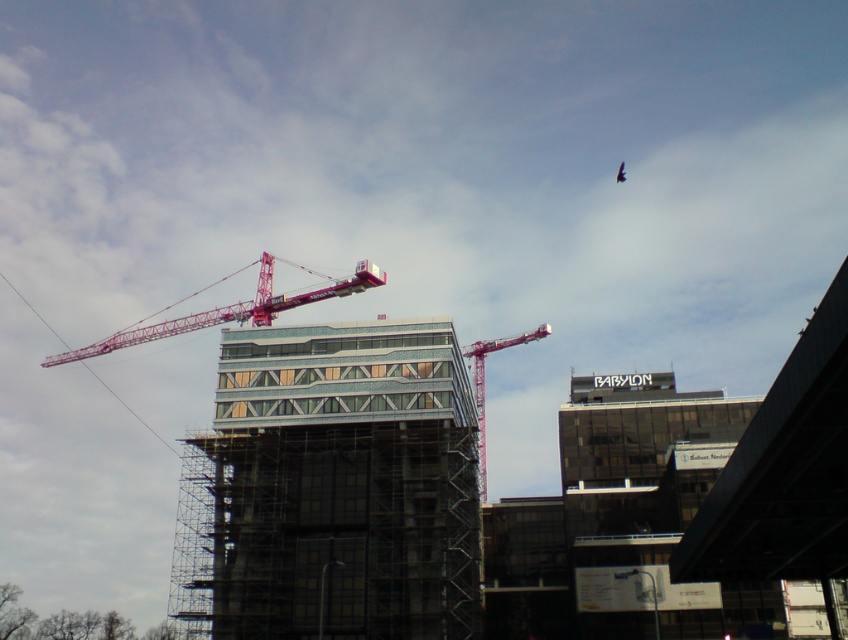
Question: Is glassy steel building at center bigger than metallic pink crane at upper center?

Choices:
 (A) no
 (B) yes

Answer: (B)

Question: Which of these objects is positioned closest to the glassy steel building at center?

Choices:
 (A) pink metallic crane at upper center
 (B) metallic pink crane at upper center

Answer: (B)

Question: Is pink metallic crane at upper center below metallic pink crane at upper center?

Choices:
 (A) yes
 (B) no

Answer: (B)

Question: Is glassy steel building at center closer to the viewer compared to pink metallic crane at upper center?

Choices:
 (A) no
 (B) yes

Answer: (B)

Question: Which point is closer to the camera?

Choices:
 (A) (143, 330)
 (B) (530, 340)
 (C) (232, 348)

Answer: (C)

Question: Considering the real-world distances, which object is farthest from the metallic pink crane at upper center?

Choices:
 (A) glassy steel building at center
 (B) pink metallic crane at upper center

Answer: (B)